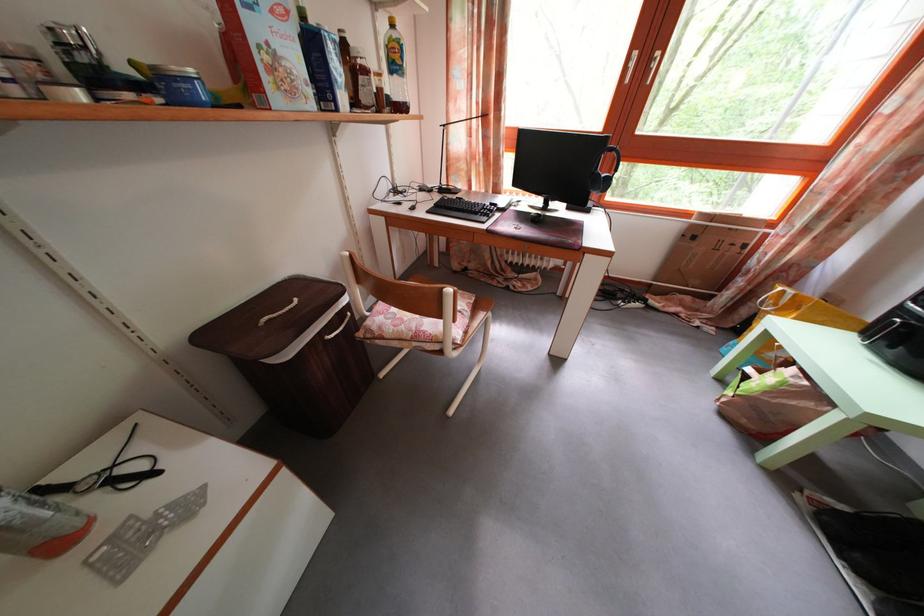
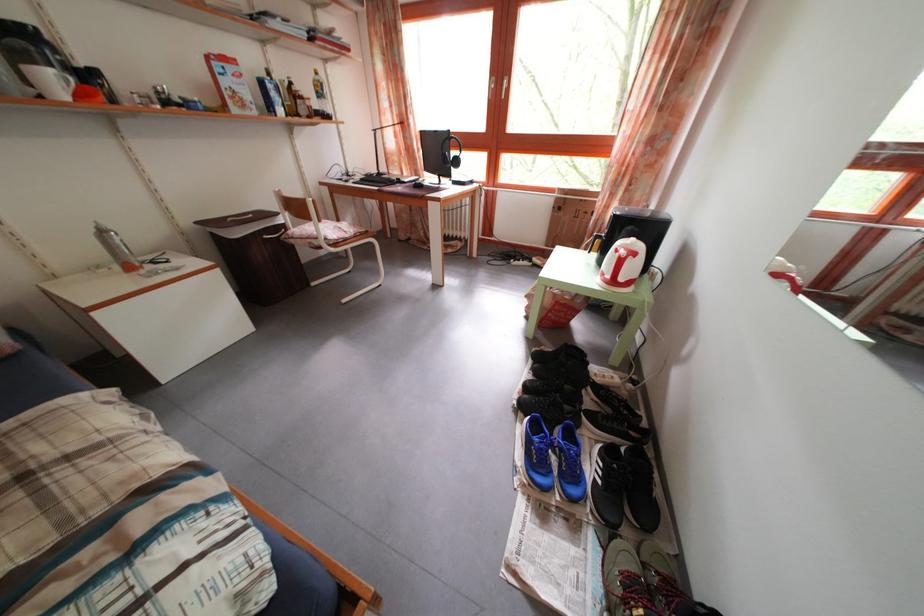
Which direction would the cameraman need to move to produce the second image?

The cameraman moved toward right, backward.